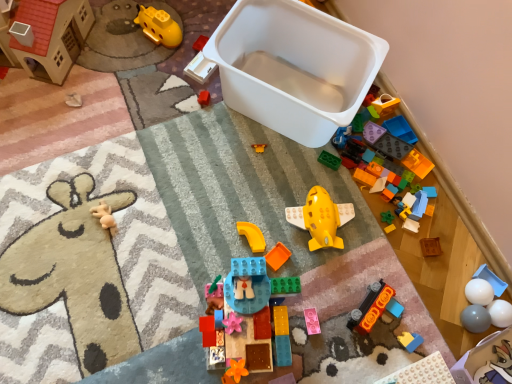
Locate an element on the screen. free space between orange matte block at center, the 11th toy from the right, and white plastic tray at upper center, placed as the 13th toy when sorted from right to left is located at coordinates (237, 161).